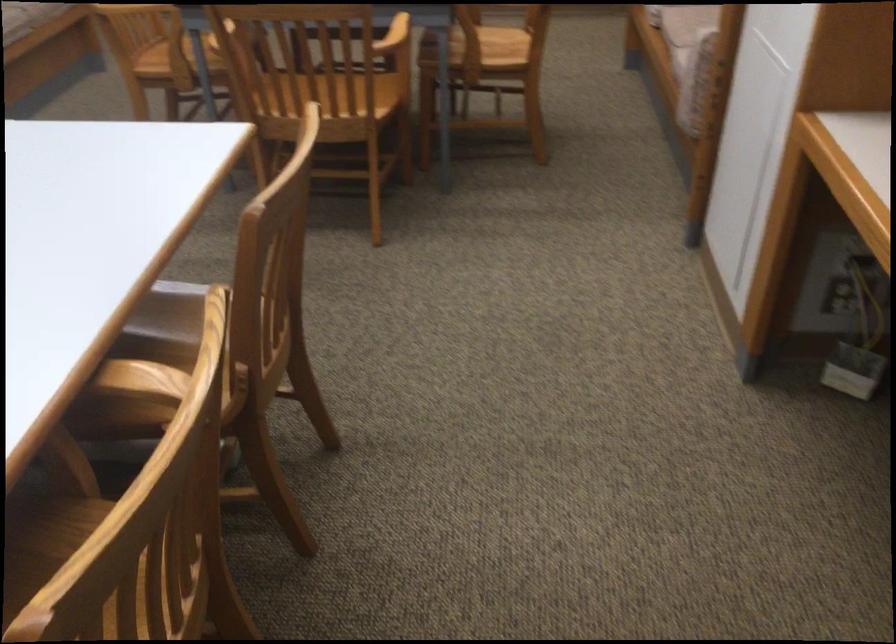
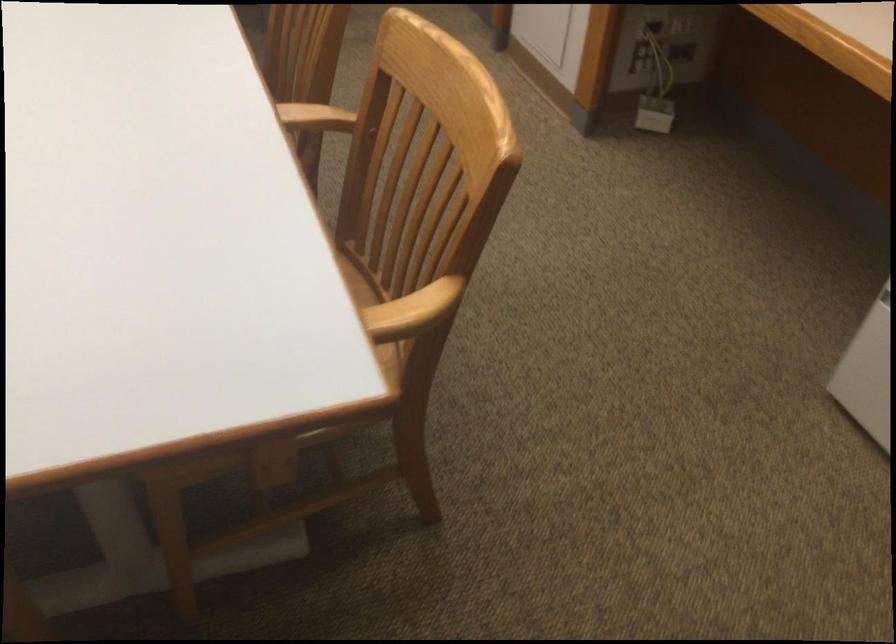
What movement of the cameraman would produce the second image?

The movement direction of the cameraman is left, backward.